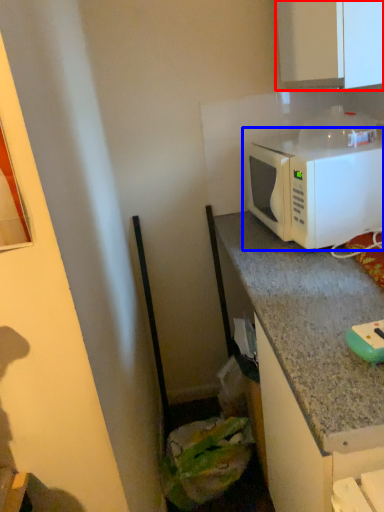
Question: Which point is closer to the camera, cabinetry (highlighted by a red box) or microwave oven (highlighted by a blue box)?

Choices:
 (A) cabinetry
 (B) microwave oven

Answer: (A)